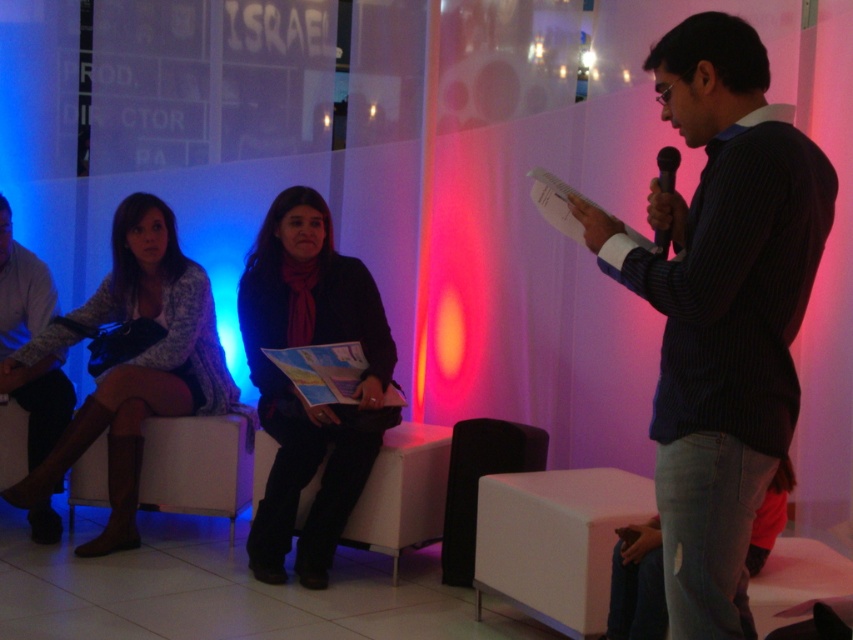
You are attending a presentation and need to hand a document to the presenter. The presenter is wearing the matte black jacket at center and holding the black plastic microphone at upper right. Which object should you approach to reach the presenter more quickly?

The matte black jacket at center is taller than the black plastic microphone at upper right, so approaching the matte black jacket at center would allow you to reach the presenter more quickly since it is closer to their body.

You are organizing a photo shoot and need to know which object takes up more visual space in the image for lighting adjustments. Based on the scene, which one is larger between the blue striped shirt at center and the knit sweater at left?

The knit sweater at left occupies more visual space than the blue striped shirt at center according to the description.